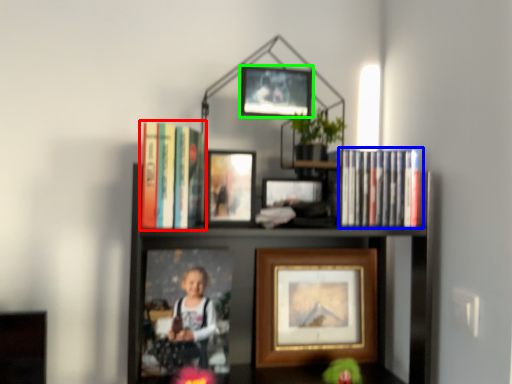
Question: Based on their relative distances, which object is nearer to book (highlighted by a red box)? Choose from book (highlighted by a blue box) and picture frame (highlighted by a green box).

Choices:
 (A) book
 (B) picture frame

Answer: (B)